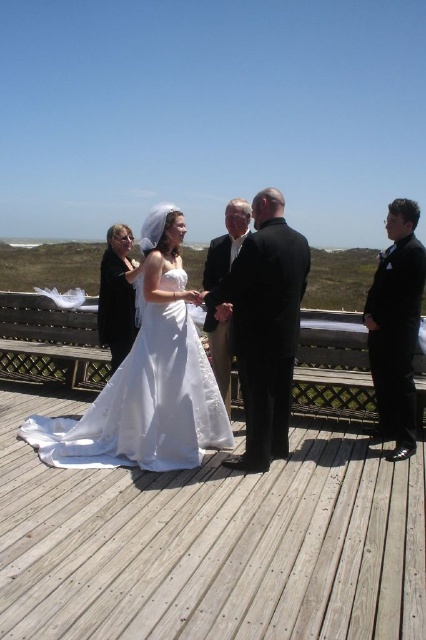
You are a photographer positioned at the front of the wooden deck where the wedding ceremony is taking place. You notice two points marked in the scene. The first point is at coordinate point (186, 456) and the second is at point (293, 243). Which of these two points is closer to your camera position?

Point (186, 456) is further to the camera than point (293, 243), so the point closer to the camera is point (293, 243).

You are a photographer at the wedding ceremony. You need to position a microphone stand so it doesn not block the view of the guests. The stand must be placed at the point marked by the coordinates point (x=117, y=294). What object will the microphone stand be placed near?

The microphone stand will be placed near the matte black dress at left, as the coordinates point (x=117, y=294) marks that object.

You are a photographer at the wedding ceremony. You need to decide which object between the matte black dress at left and the smooth black suit at center requires more space in your camera frame because of its size. Which one do you choose?

The matte black dress at left is wider than the smooth black suit at center, so you should choose the matte black dress at left to accommodate its larger width in the camera frame.